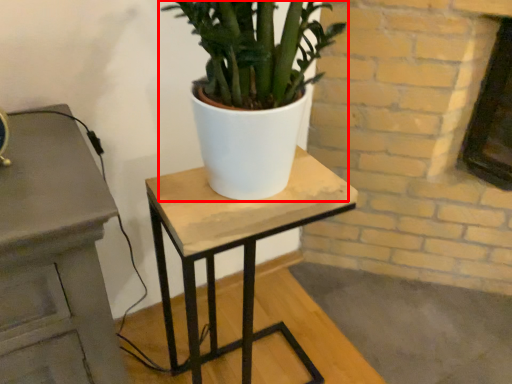
Question: From the image, what is the correct spatial relationship of houseplant (annotated by the red box) in relation to table?

Choices:
 (A) right
 (B) left

Answer: (A)